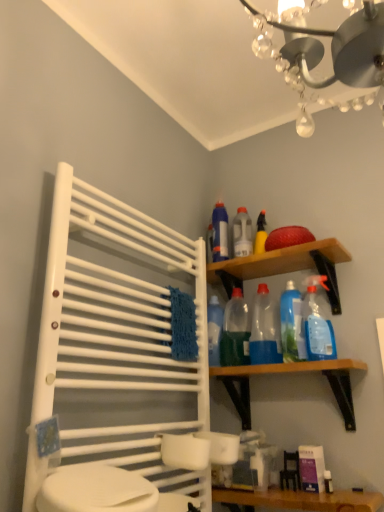
Question: Looking at their shapes, would you say wooden shelf at upper right, the first shelf when ordered from top to bottom, is wider or thinner than translucent plastic spray bottle at upper right, which ranks as the fourth cleaning product in left-to-right order?

Choices:
 (A) thin
 (B) wide

Answer: (B)

Question: Is wooden shelf at upper right, which is the 2th shelf from bottom to top, taller or shorter than translucent plastic spray bottle at upper right, which ranks as the fourth cleaning product in left-to-right order?

Choices:
 (A) short
 (B) tall

Answer: (A)

Question: Considering the real-world distances, which object is closest to the translucent plastic spray bottle at upper right, which ranks as the fourth cleaning product in left-to-right order?

Choices:
 (A) white plastic towel rack at left
 (B) wooden shelf at upper right, which is the 2th shelf from bottom to top
 (C) translucent plastic bottles at upper right, the 2th cleaning product in the right-to-left sequence
 (D) translucent plastic bottle at center, which is counted as the second bottle, starting from the top
 (E) translucent plastic bottle at upper center, the 1th bottle in the back-to-front sequence

Answer: (C)

Question: Considering the real-world distances, which object is closest to the wooden vanity at lower center?

Choices:
 (A) white plastic towel rack at left
 (B) translucent plastic spray bottle at upper right, the first cleaning product viewed from the right
 (C) blue plastic spray bottle at upper right, which appears as the 1th cleaning product when viewed from the left
 (D) wooden shelf at upper right, the first shelf when ordered from top to bottom
 (E) wooden shelf at upper right, the 1th shelf in the bottom-to-top sequence

Answer: (E)